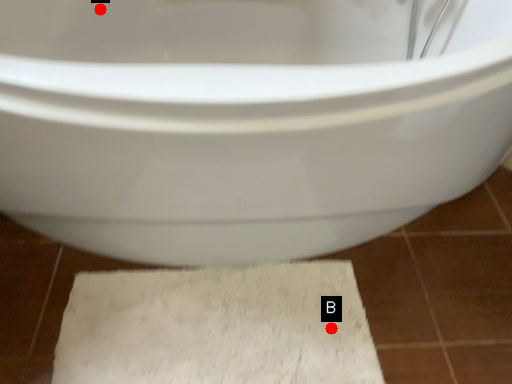
Question: Two points are circled on the image, labeled by A and B beside each circle. Which point is closer to the camera?

Choices:
 (A) A is closer
 (B) B is closer

Answer: (B)